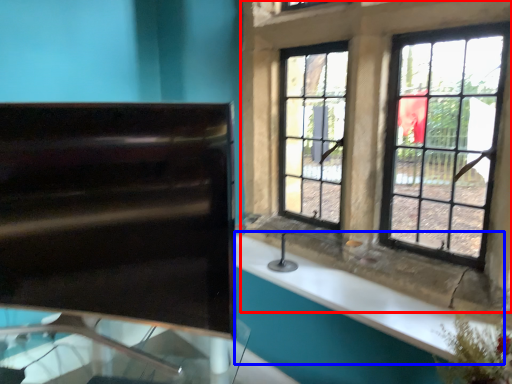
Question: Which object is further to the camera taking this photo, window (highlighted by a red box) or counter top (highlighted by a blue box)?

Choices:
 (A) window
 (B) counter top

Answer: (B)